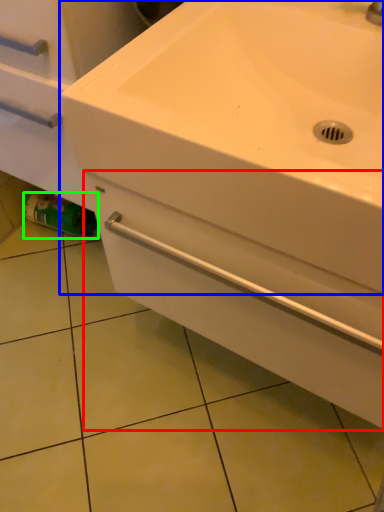
Question: Which object is positioned closest to drawer (highlighted by a red box)? Select from sink (highlighted by a blue box) and toilet paper (highlighted by a green box).

Choices:
 (A) sink
 (B) toilet paper

Answer: (A)